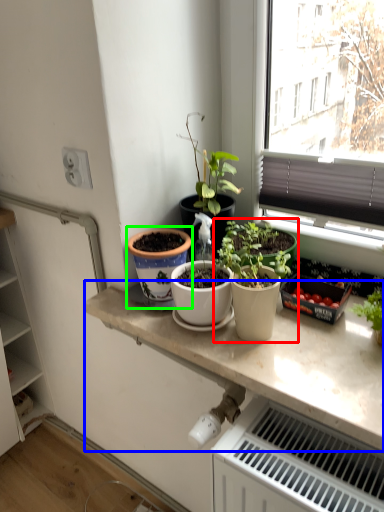
Question: Estimate the real-world distances between objects in this image. Which object is farther from houseplant (highlighted by a red box), countertop (highlighted by a blue box) or flowerpot (highlighted by a green box)?

Choices:
 (A) countertop
 (B) flowerpot

Answer: (B)